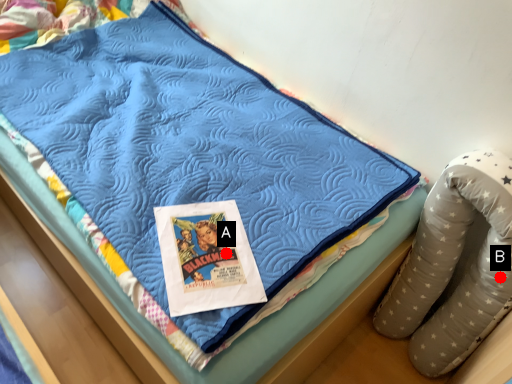
Question: Two points are circled on the image, labeled by A and B beside each circle. Which point appears closest to the camera in this image?

Choices:
 (A) A is closer
 (B) B is closer

Answer: (A)